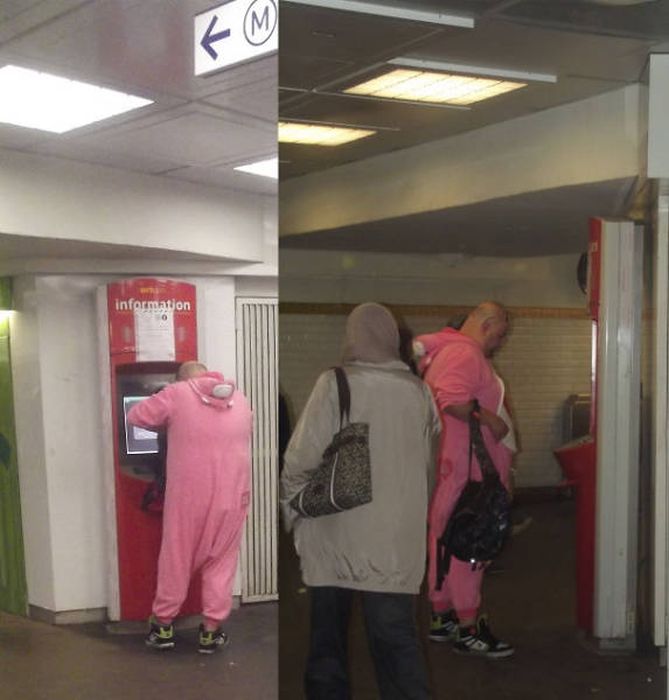
Where is `entryway`? This screenshot has height=700, width=669. entryway is located at coordinates (17, 554).